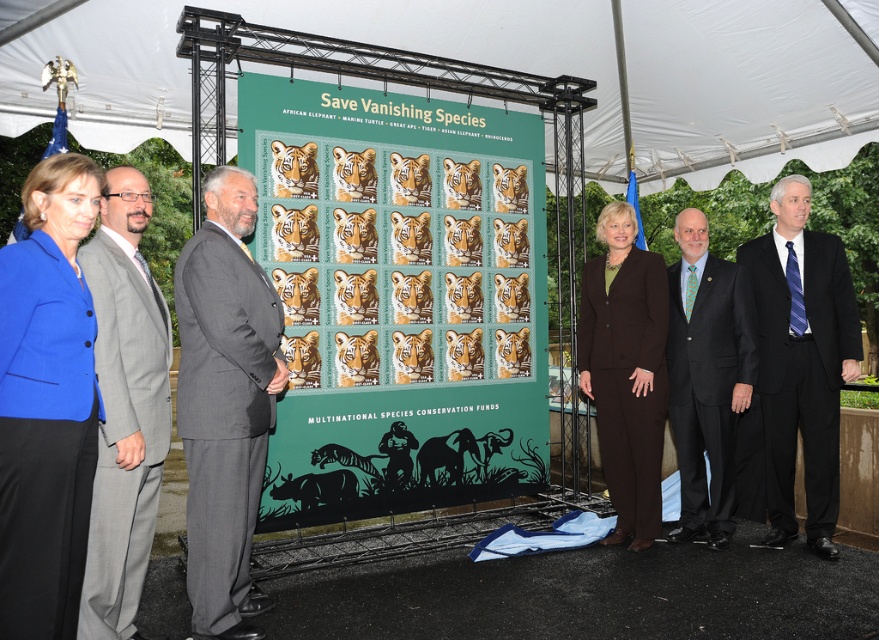
You are a photographer at the event and need to capture a photo of the gray suit at left and brown woolen suit at center. Which one is closer to the camera?

The gray suit at left is closer to the camera because it is in front of the brown woolen suit at center.

You are an event organizer who needs to ensure that the blue fabric jacket at left is visible to all attendees. Given that the green matte poster at center is in front of it, will the poster block the jacket from view?

The green matte poster at center is wider than the blue fabric jacket at left. Since the poster is in front of the jacket, it will block part or all of the jacket from view depending on their positions. However, the description only mentions the poster is wider, not its distance from the jacket. Without knowing the distance between them, we cannot definitively conclude if the jacket is fully visible. Please check the spatial arrangement for confirmation.